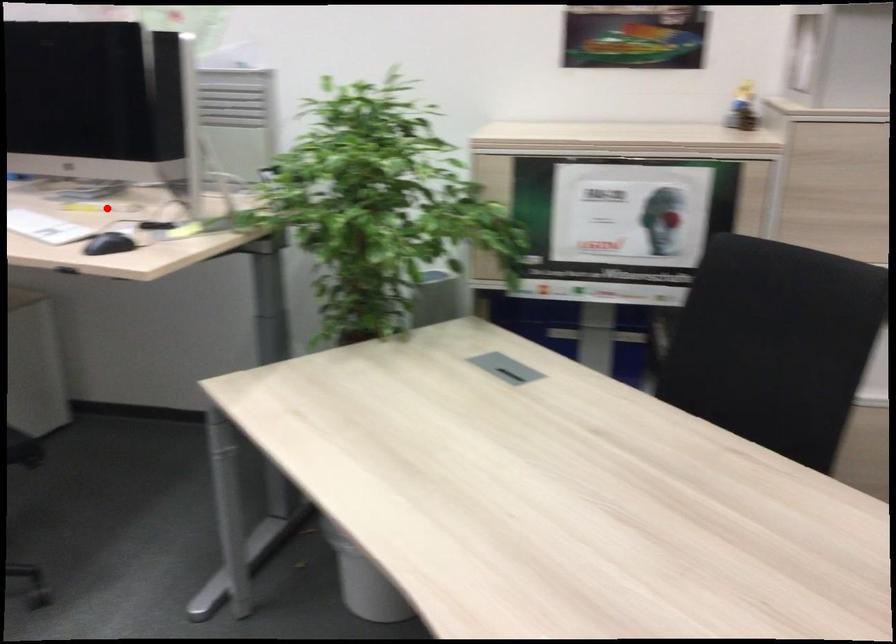
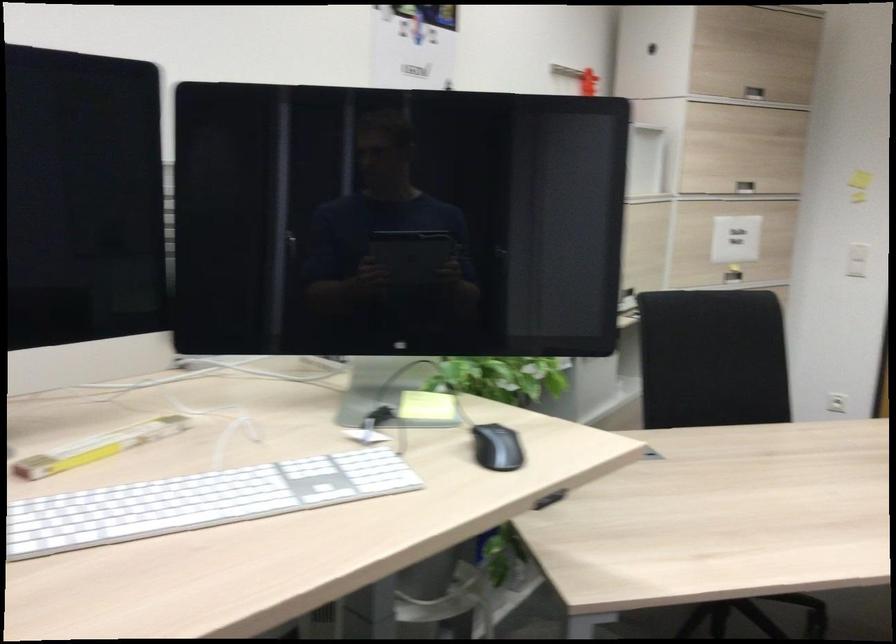
Question: I am providing you with two images of the same scene from different viewpoints. Image1 has a red point marked. In image2, the corresponding 3D location appears at what relative position? Reply with the corresponding letter.

Choices:
 (A) Closer
 (B) Farther

Answer: (A)